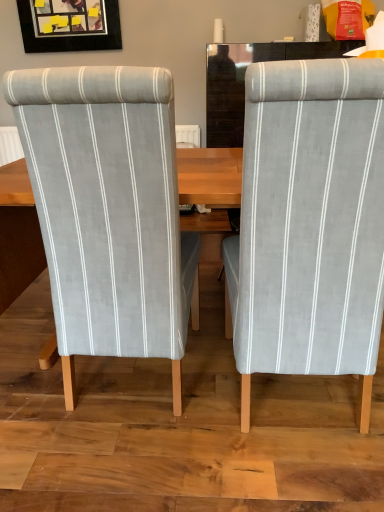
Image resolution: width=384 pixels, height=512 pixels. I want to click on free region under light gray fabric chair at left, the first chair in the left-to-right sequence (from a real-world perspective), so click(131, 385).